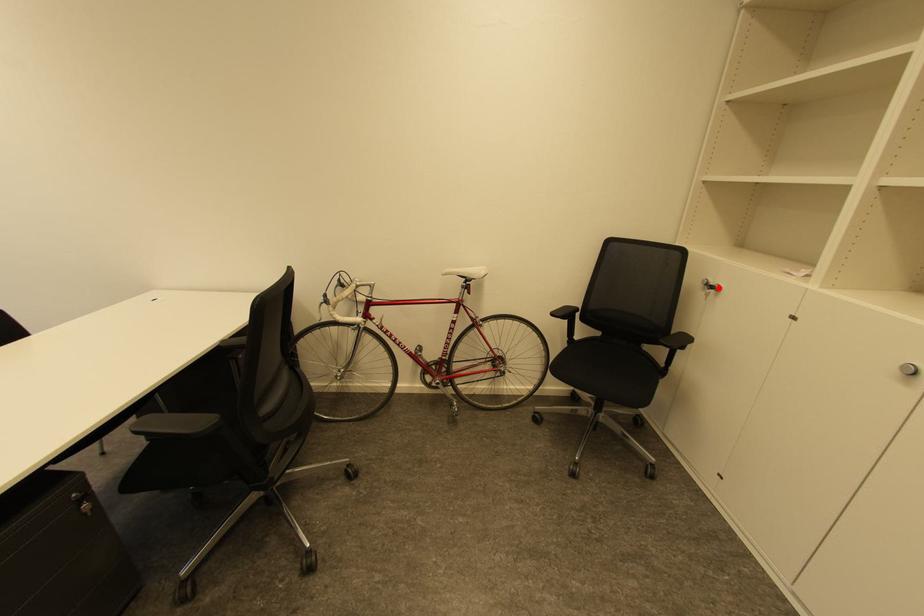
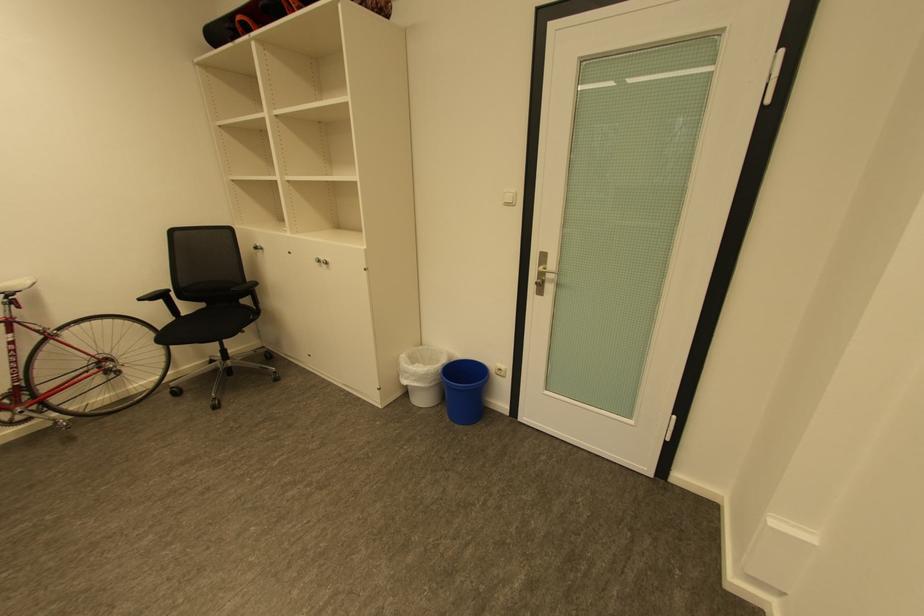
The point at the highlighted location is marked in the first image. Where is the corresponding point in the second image?

(262, 248)